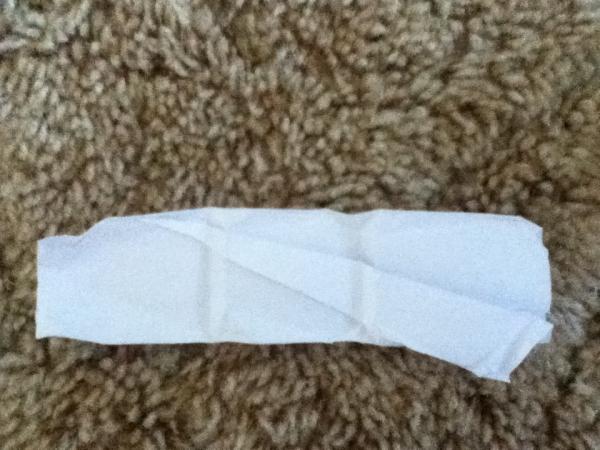
The height and width of the screenshot is (450, 600). Find the location of `khaki colored rug`. khaki colored rug is located at coordinates (35, 136), (393, 51), (400, 166), (372, 382), (537, 370).